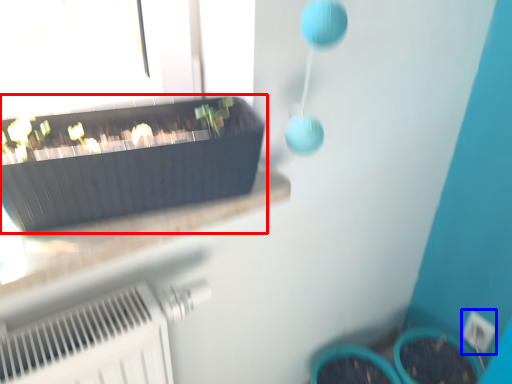
Question: Among these objects, which one is farthest to the camera, flowerpot (highlighted by a red box) or electric outlet (highlighted by a blue box)?

Choices:
 (A) flowerpot
 (B) electric outlet

Answer: (B)